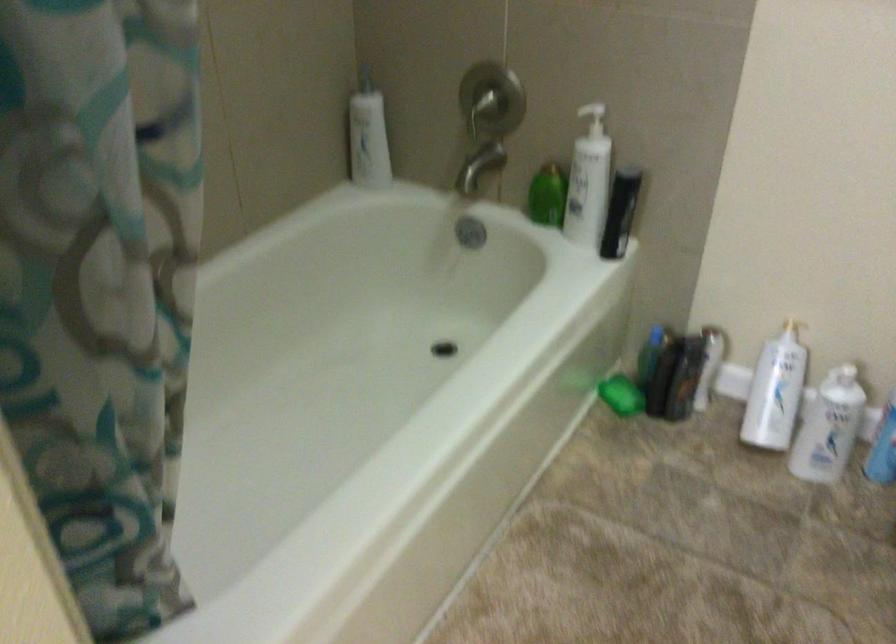
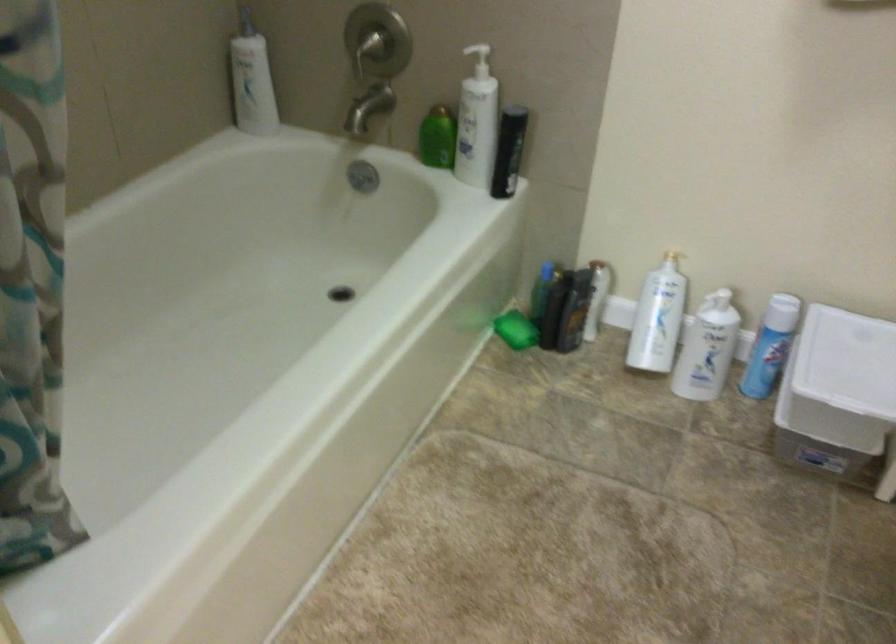
Find the pixel in the second image that matches pixel 587 185 in the first image.

(477, 122)